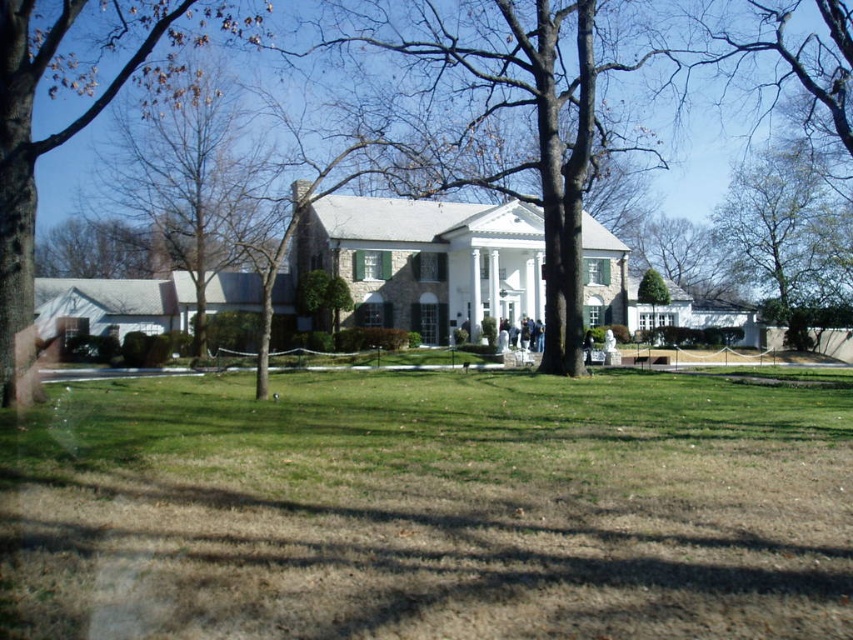
You are standing in front of the house and want to walk to the green leafy tree at upper right. Which direction should you move relative to the brown leafy tree at upper left?

Since the brown leafy tree at upper left is closer to you than the green leafy tree at upper right, you should move towards the upper right direction away from the brown leafy tree at upper left to reach the green leafy tree at upper right.

You are standing in front of the house and want to determine the relative positions of two points marked in the image. Which point is closer to you, point (79, 51) or point (751, 198)?

Point (79, 51) is closer to the viewer than point (751, 198).

You are standing in front of the house and want to walk from the green grass at center to the green leafy tree at center. Which direction should you move to reach the tree?

The green grass at center is in front of the green leafy tree at center, so to reach the tree, you should move backward away from the house towards it.